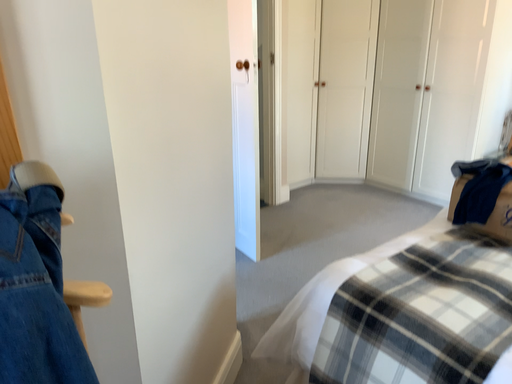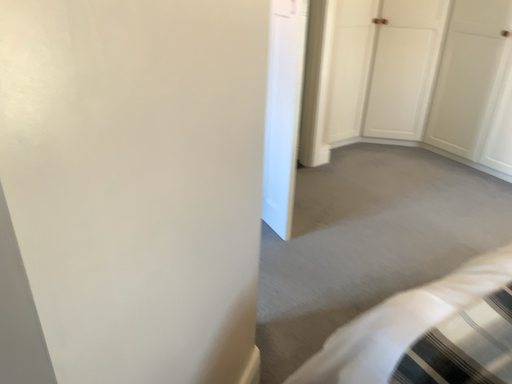
Question: How did the camera likely rotate when shooting the video?

Choices:
 (A) rotated upward
 (B) rotated downward

Answer: (B)